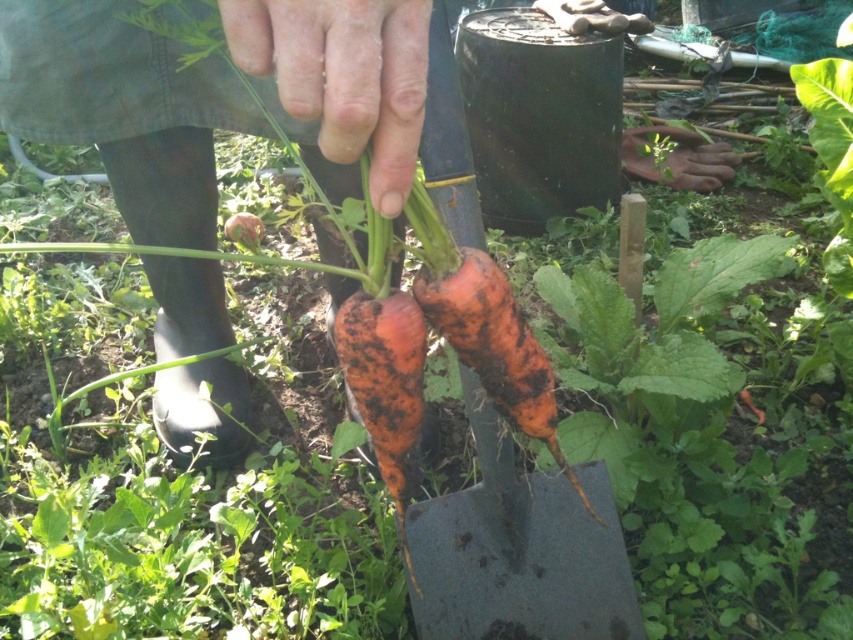
Can you confirm if orange rough skin carrot at center is smaller than dull orange carrot at center?

Actually, orange rough skin carrot at center might be larger than dull orange carrot at center.

Which is more to the left, orange rough skin carrot at center or dull orange carrot at center?

dull orange carrot at center is more to the left.

Which is behind, point (550, 432) or point (403, 385)?

Point (550, 432)

Locate an element on the screen. The image size is (853, 640). orange rough skin carrot at center is located at coordinates (495, 346).

Locate an element on the screen. The height and width of the screenshot is (640, 853). dry skin at center is located at coordinates (344, 76).

From the picture: Which of these two, dry skin at center or orange rough skin carrot at center, stands shorter?

→ With less height is dry skin at center.

Where is `dry skin at center`? This screenshot has height=640, width=853. dry skin at center is located at coordinates (344, 76).

Which is more to the left, orange rough skin carrot at center or orange rough carrot at center?

From the viewer's perspective, orange rough carrot at center appears more on the left side.

Locate an element on the screen. orange rough skin carrot at center is located at coordinates (495, 346).